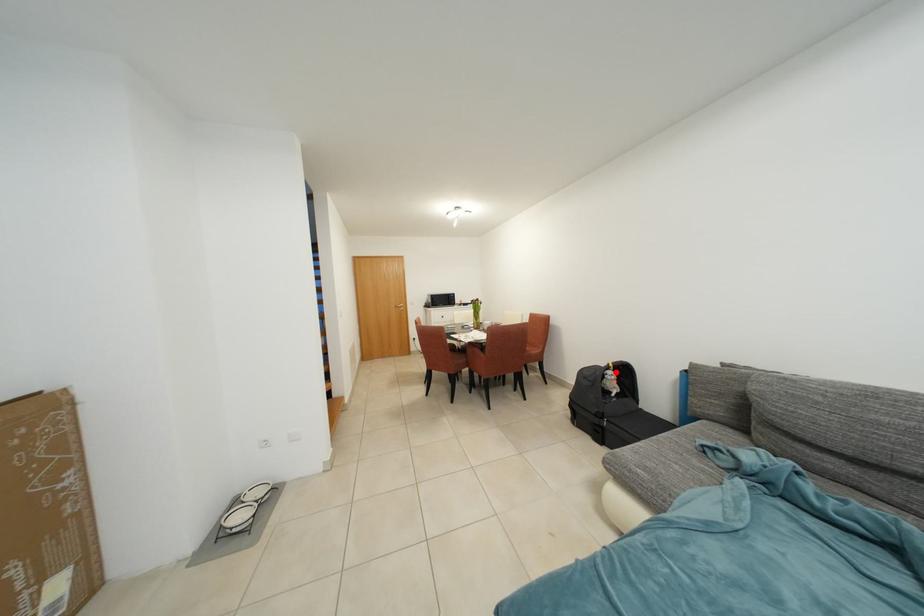
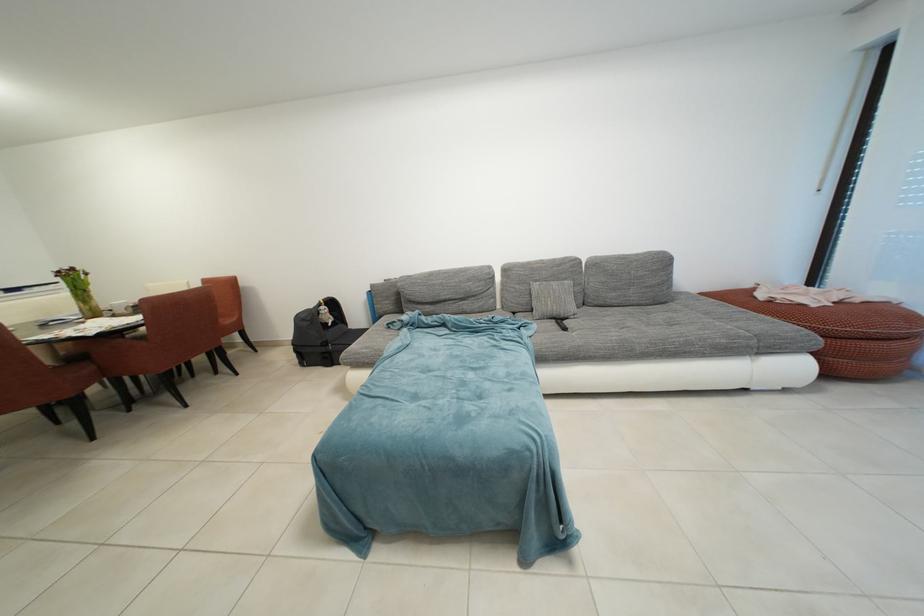
Question: I am providing you with two images of the same scene from different viewpoints. A red point is marked on the first image. At the location where the point appears in image 1, is it still visible in image 2?

Choices:
 (A) Yes
 (B) No

Answer: (A)